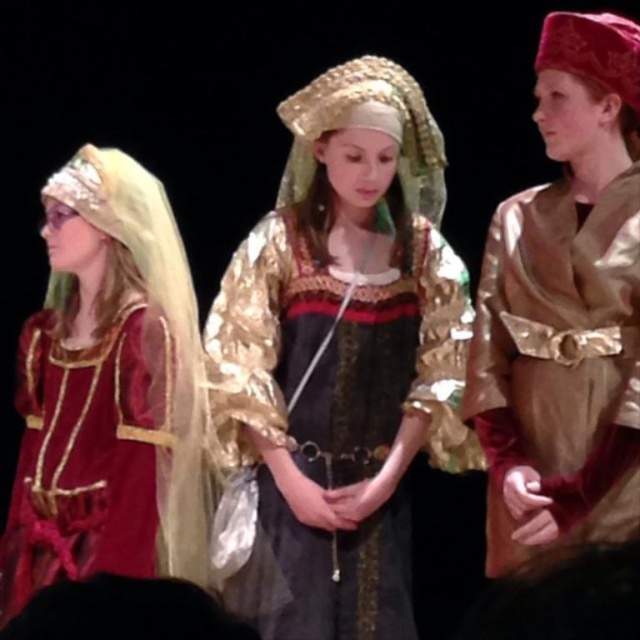
Which is below, gold metallic dress at center or gold satin robe at right?

gold metallic dress at center is lower down.

At what (x,y) coordinates should I click in order to perform the action: click on gold metallic dress at center. Please return your answer as a coordinate pair (x, y). This screenshot has width=640, height=640. Looking at the image, I should click on (342, 356).

Is point (348, 620) positioned in front of point (513, 307)?

No, it is behind (513, 307).

This screenshot has height=640, width=640. I want to click on gold metallic dress at center, so click(342, 356).

Who is more forward, (612, 310) or (145, 433)?

Point (612, 310) is more forward.

Does gold satin robe at right have a larger size compared to matte gold dress at center?

No.

Find the location of a particular element. gold satin robe at right is located at coordinates (564, 308).

You are a GUI agent. You are given a task and a screenshot of the screen. Output one action in this format:
    pyautogui.click(x=<x>, y=<y>)
    Task: Click on the gold satin robe at right
    
    Given the screenshot: What is the action you would take?
    pyautogui.click(x=564, y=308)

Does gold metallic dress at center have a smaller size compared to matte gold dress at center?

Incorrect, gold metallic dress at center is not smaller in size than matte gold dress at center.

Between gold metallic dress at center and matte gold dress at center, which one appears on the left side from the viewer's perspective?

matte gold dress at center is more to the left.

Which is behind, point (365, 458) or point (106, 516)?

Positioned behind is point (365, 458).

The width and height of the screenshot is (640, 640). Find the location of `gold metallic dress at center`. gold metallic dress at center is located at coordinates (342, 356).